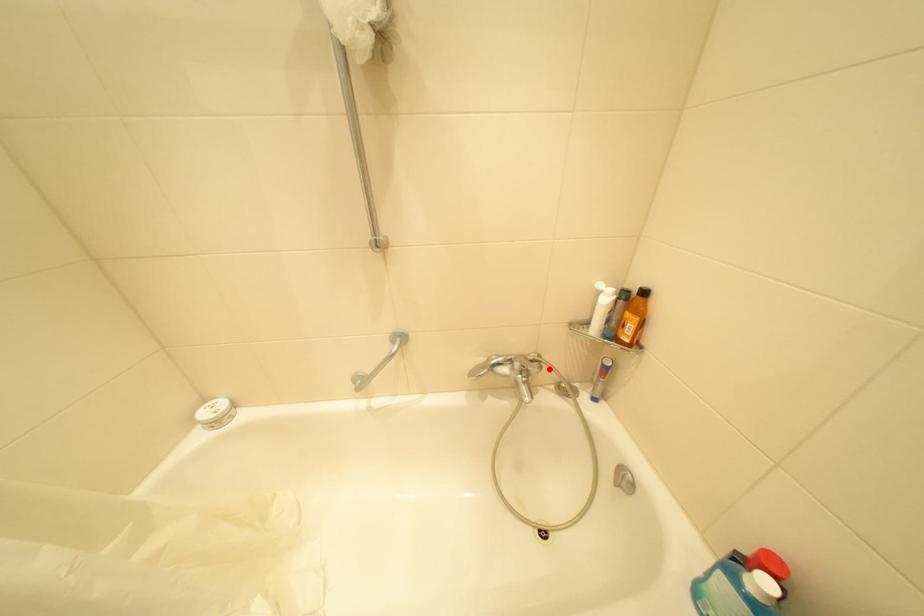
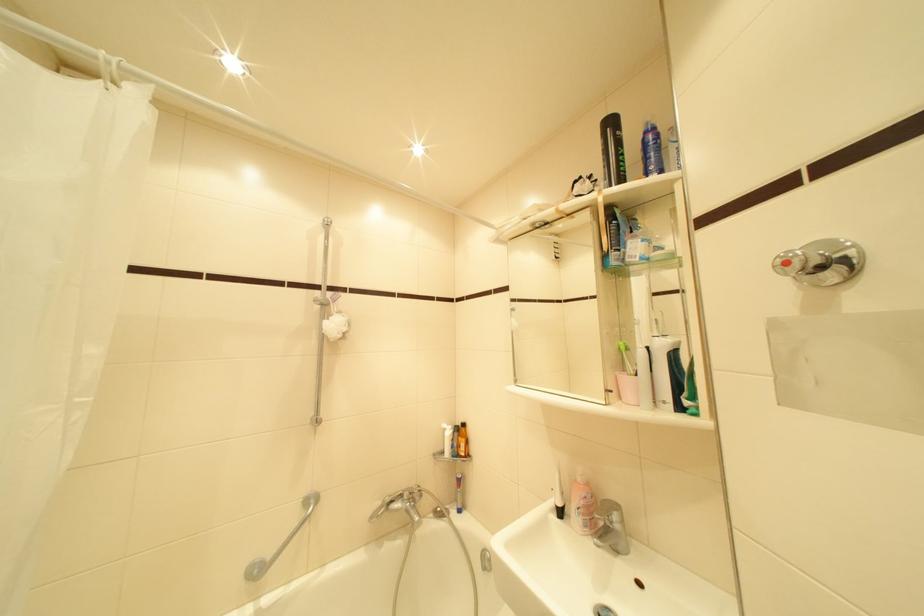
Question: I am providing you with two images of the same scene from different viewpoints. In image1, a red point is highlighted. Considering the same 3D point in image2, which of the following is correct?

Choices:
 (A) It is closer
 (B) It is farther

Answer: (B)